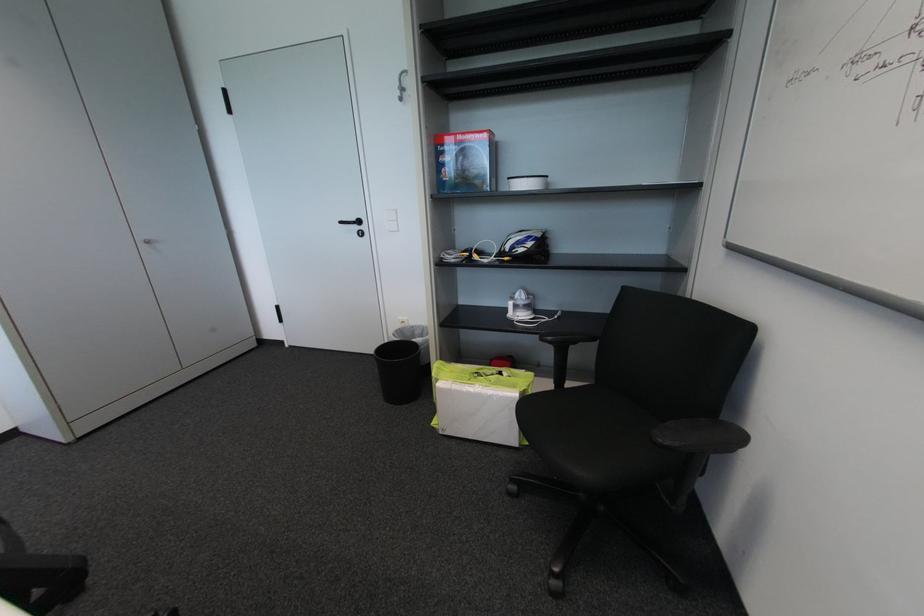
Where is `white electric juicer`? white electric juicer is located at coordinates (520, 305).